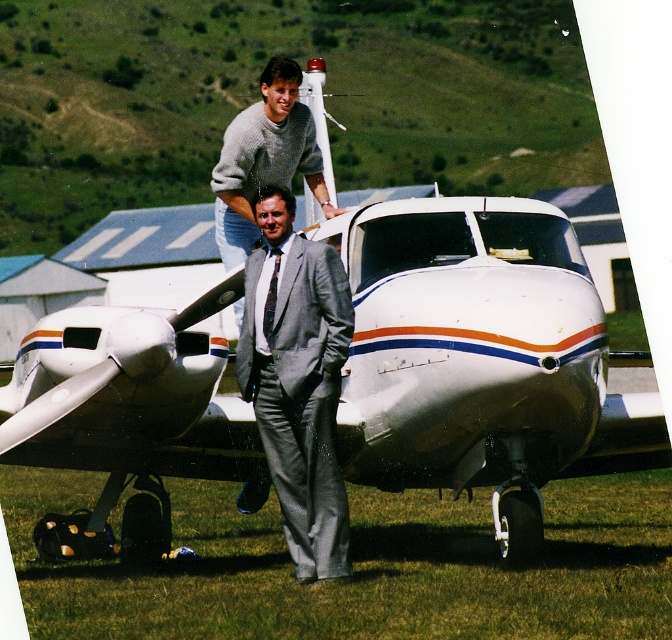
Question: Is knitted sweater at upper center further to the viewer compared to patterned silk tie at center?

Choices:
 (A) no
 (B) yes

Answer: (A)

Question: Which point is closer to the camera taking this photo?

Choices:
 (A) (265, 214)
 (B) (276, 115)

Answer: (A)

Question: Does knitted sweater at upper center have a larger size compared to patterned silk tie at center?

Choices:
 (A) yes
 (B) no

Answer: (A)

Question: Among these objects, which one is farthest from the camera?

Choices:
 (A) knitted sweater at upper center
 (B) gray suit at center
 (C) patterned silk tie at center

Answer: (C)

Question: Which object appears farthest from the camera in this image?

Choices:
 (A) patterned silk tie at center
 (B) gray suit at center

Answer: (A)

Question: Is gray suit at center thinner than knitted sweater at upper center?

Choices:
 (A) yes
 (B) no

Answer: (A)